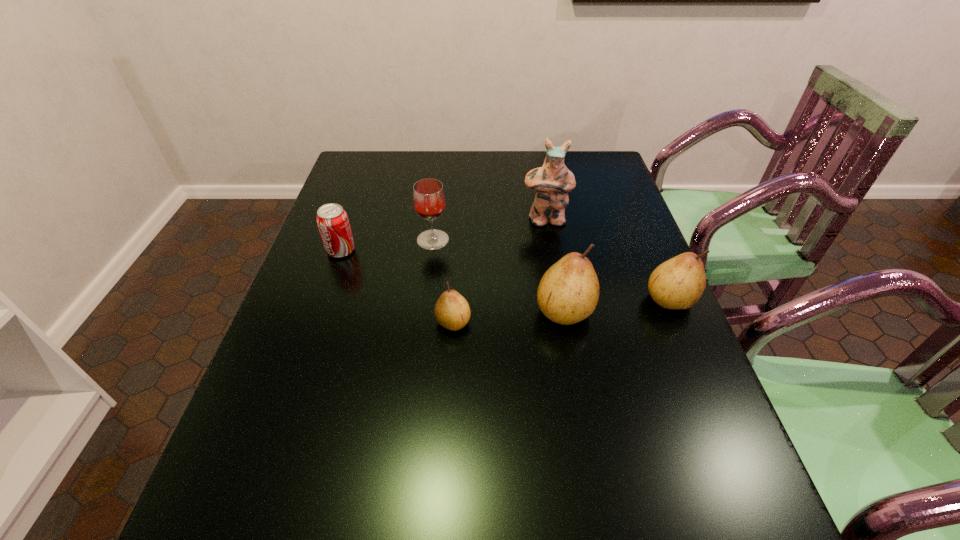
Where is `free space between the second pear from left to right and the wineglass`? Image resolution: width=960 pixels, height=540 pixels. free space between the second pear from left to right and the wineglass is located at coordinates (498, 275).

The height and width of the screenshot is (540, 960). In order to click on unoccupied area between the figurine and the leftmost pear in this screenshot , I will do `click(499, 272)`.

Where is `object that is the third closest to the wineglass`? The width and height of the screenshot is (960, 540). object that is the third closest to the wineglass is located at coordinates (452, 311).

Locate which object is the third closest to the rightmost object. Please provide its 2D coordinates. Your answer should be formatted as a tuple, i.e. [(x, y)], where the tuple contains the x and y coordinates of a point satisfying the conditions above.

[(452, 311)]

The width and height of the screenshot is (960, 540). Identify the location of the closest pear to the figurine. (568, 293).

Identify which pear is the second closest to the fifth tallest object. Please provide its 2D coordinates. Your answer should be formatted as a tuple, i.e. [(x, y)], where the tuple contains the x and y coordinates of a point satisfying the conditions above.

[(568, 293)]

Where is `free space that satisfies the following two spatial constraints: 1. on the front side of the second pear from right to left; 2. on the right side of the wineglass`? This screenshot has width=960, height=540. free space that satisfies the following two spatial constraints: 1. on the front side of the second pear from right to left; 2. on the right side of the wineglass is located at coordinates (424, 310).